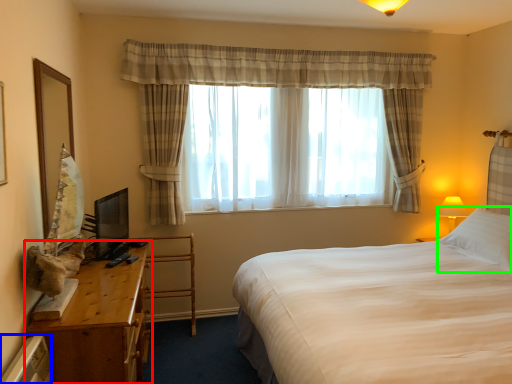
Question: Which object is the farthest from table (highlighted by a red box)? Choose among these: radiator (highlighted by a blue box) or pillow (highlighted by a green box).

Choices:
 (A) radiator
 (B) pillow

Answer: (B)